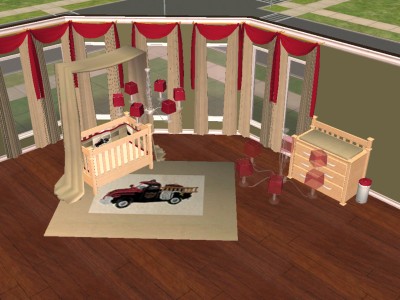
Find the location of a particular element. baby crib is located at coordinates (111, 175).